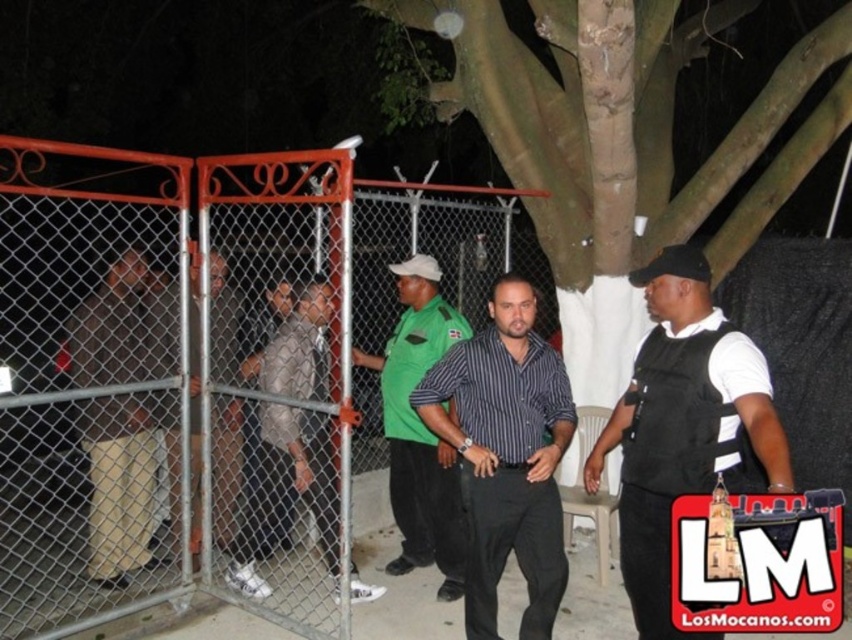
Question: Does khaki pants at left appear on the left side of light brown leather shoes at center?

Choices:
 (A) no
 (B) yes

Answer: (B)

Question: Which point is farther to the camera?

Choices:
 (A) coord(311,465)
 (B) coord(636,282)
 (C) coord(213,353)

Answer: (C)

Question: Which object appears farthest from the camera in this image?

Choices:
 (A) green uniform shirt at center
 (B) khaki pants at left

Answer: (A)

Question: Among these points, which one is farthest from the camera?

Choices:
 (A) (194, 360)
 (B) (102, 433)

Answer: (A)

Question: Does striped cotton shirt at center have a lesser width compared to light brown leather shoes at center?

Choices:
 (A) no
 (B) yes

Answer: (A)

Question: Is orange chain-link fence at left positioned in front of striped cotton shirt at center?

Choices:
 (A) no
 (B) yes

Answer: (B)